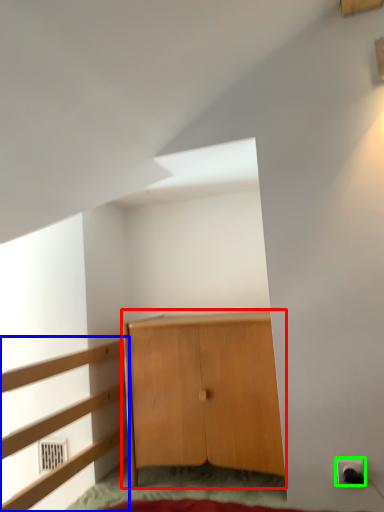
Question: Which object is positioned farthest from cupboard (highlighted by a red box)? Select from dresser (highlighted by a blue box) and electric outlet (highlighted by a green box).

Choices:
 (A) dresser
 (B) electric outlet

Answer: (B)